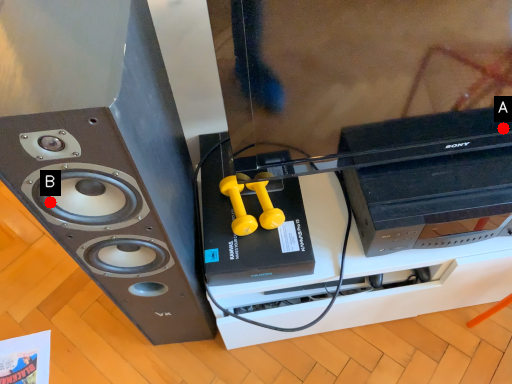
Question: Two points are circled on the image, labeled by A and B beside each circle. Which point appears closest to the camera in this image?

Choices:
 (A) A is closer
 (B) B is closer

Answer: (B)